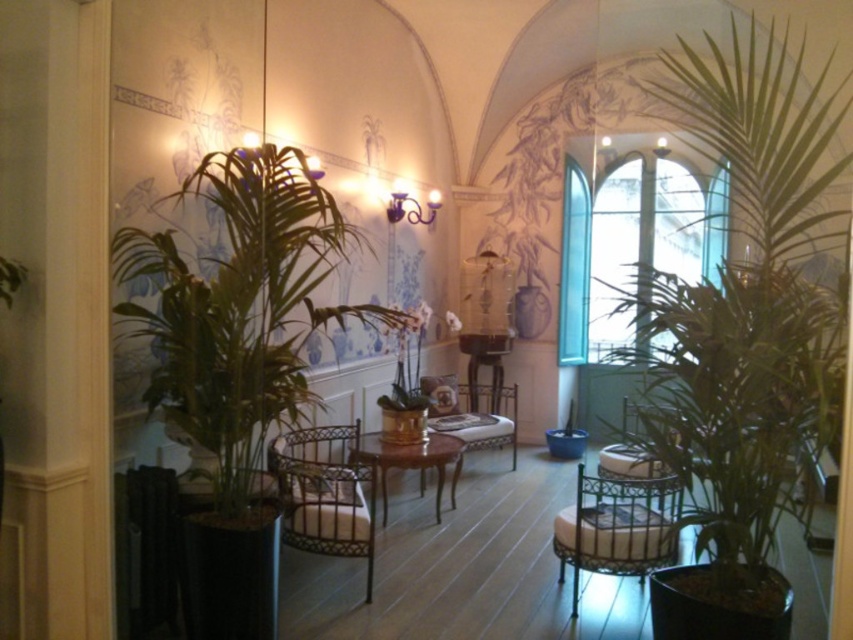
Question: Which of the following is the farthest from the observer?

Choices:
 (A) green leafy plant at left
 (B) metallic woven armchair at center
 (C) wooden polished table at center
 (D) metallic silver armchair at center

Answer: (D)

Question: Which of the following is the farthest from the observer?

Choices:
 (A) metallic silver armchair at center
 (B) metallic gold armchair at center
 (C) wooden polished table at center

Answer: (A)

Question: Can you confirm if metallic woven armchair at center is wider than wooden polished table at center?

Choices:
 (A) yes
 (B) no

Answer: (B)

Question: Can you confirm if green leafy plant at left is positioned to the left of metallic silver armchair at center?

Choices:
 (A) yes
 (B) no

Answer: (A)

Question: Can you confirm if metallic gold armchair at center is positioned to the left of metallic woven armchair at center?

Choices:
 (A) yes
 (B) no

Answer: (B)

Question: Among these points, which one is nearest to the camera?

Choices:
 (A) (212, 168)
 (B) (424, 451)
 (C) (433, 387)

Answer: (A)